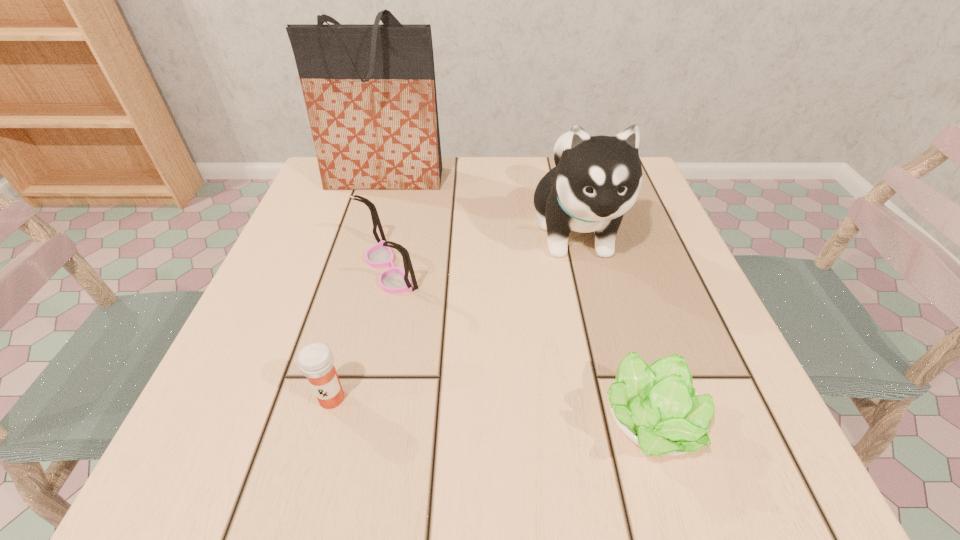
The height and width of the screenshot is (540, 960). In order to click on object that is positioned at the near right corner in this screenshot , I will do `click(656, 406)`.

Where is `free region at the far edge of the desktop`? The image size is (960, 540). free region at the far edge of the desktop is located at coordinates (530, 202).

The width and height of the screenshot is (960, 540). In the image, there is a desktop. What are the coordinates of `vacant region at the near edge` in the screenshot? It's located at (588, 431).

At what (x,y) coordinates should I click in order to perform the action: click on vacant region at the left edge. Please return your answer as a coordinate pair (x, y). The width and height of the screenshot is (960, 540). Looking at the image, I should click on (243, 363).

Image resolution: width=960 pixels, height=540 pixels. In order to click on free space at the right edge of the desktop in this screenshot , I will do `click(663, 294)`.

The image size is (960, 540). In order to click on free spot between the second shortest object and the fourth shortest object in this screenshot , I will do `click(453, 314)`.

In order to click on free point between the shortest object and the second tallest object in this screenshot , I will do `click(612, 327)`.

At what (x,y) coordinates should I click in order to perform the action: click on free spot between the third tallest object and the shopping bag. Please return your answer as a coordinate pair (x, y). The width and height of the screenshot is (960, 540). Looking at the image, I should click on click(387, 225).

Where is `vacant region between the shortest object and the fourth shortest object`? The height and width of the screenshot is (540, 960). vacant region between the shortest object and the fourth shortest object is located at coordinates (612, 327).

Find the location of a particular element. empty location between the third tallest object and the shortest object is located at coordinates (518, 347).